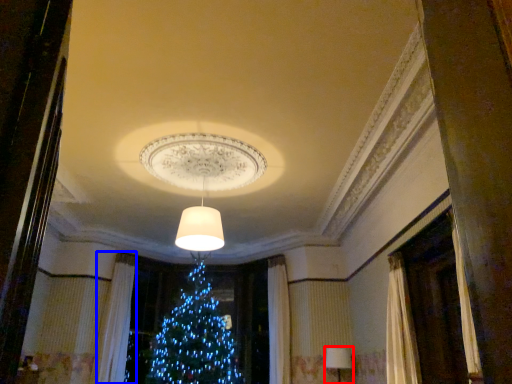
Question: Which of the following is the farthest to the observer, lamp (highlighted by a red box) or curtain (highlighted by a blue box)?

Choices:
 (A) lamp
 (B) curtain

Answer: (B)